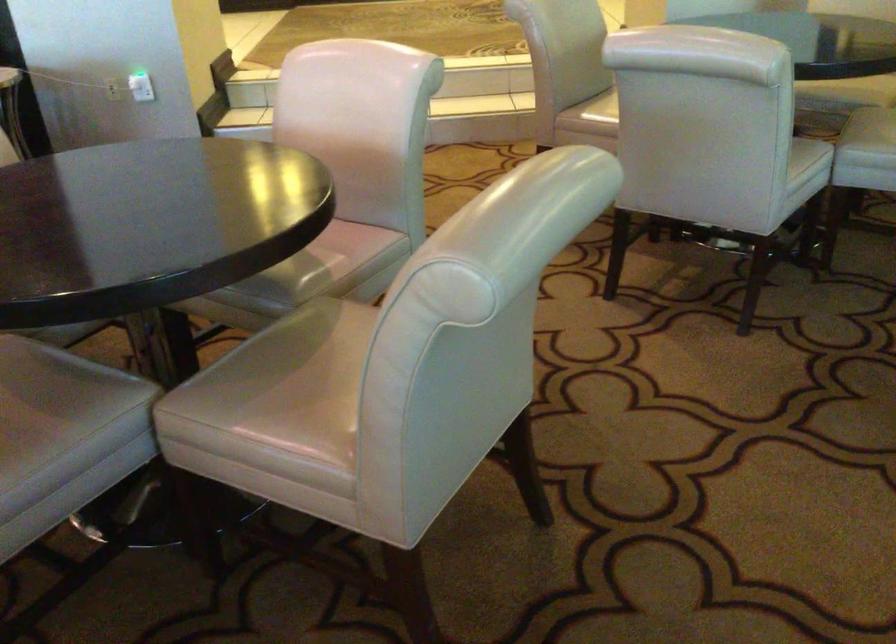
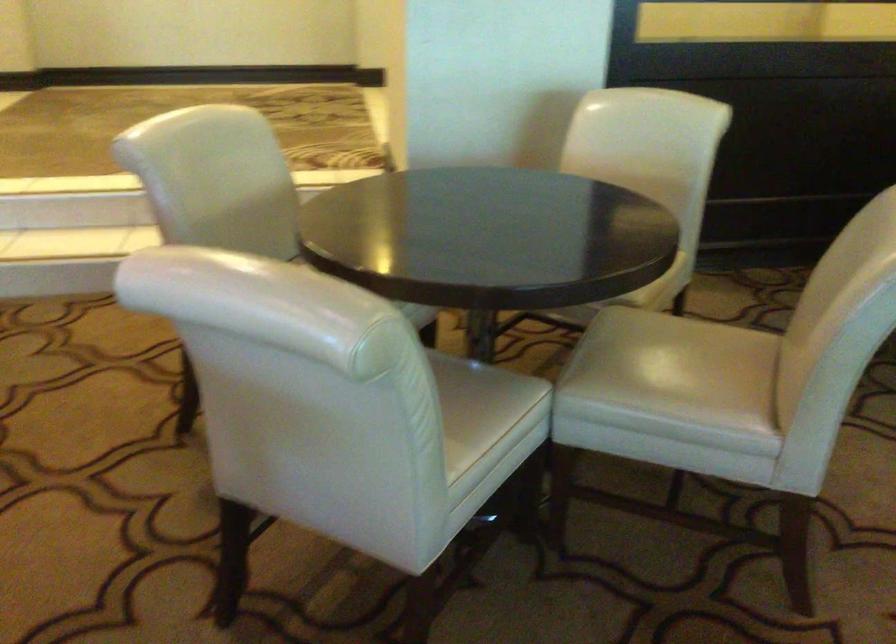
Which direction would the cameraman need to move to produce the second image?

The movement direction of the cameraman is right, forward.